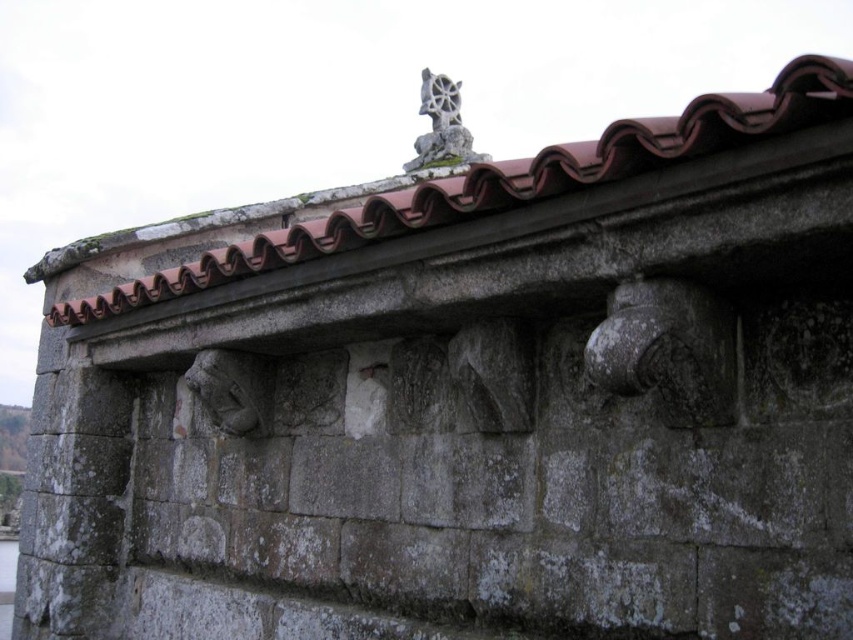
You are an architect examining the stone structure. You notice the brown clay tiles at upper center and the gray stone sculpture at upper center. Which of these two objects is located to the left when viewed from your perspective?

The brown clay tiles at upper center are positioned to the left of the gray stone sculpture at upper center, so they are the object located to the left.

You are an architect examining the stone wall and its roof. You notice the brown clay tiles at upper center and the gray stone sculpture at upper center. Which of these two objects is larger in size?

The gray stone sculpture at upper center is larger than the brown clay tiles at upper center.